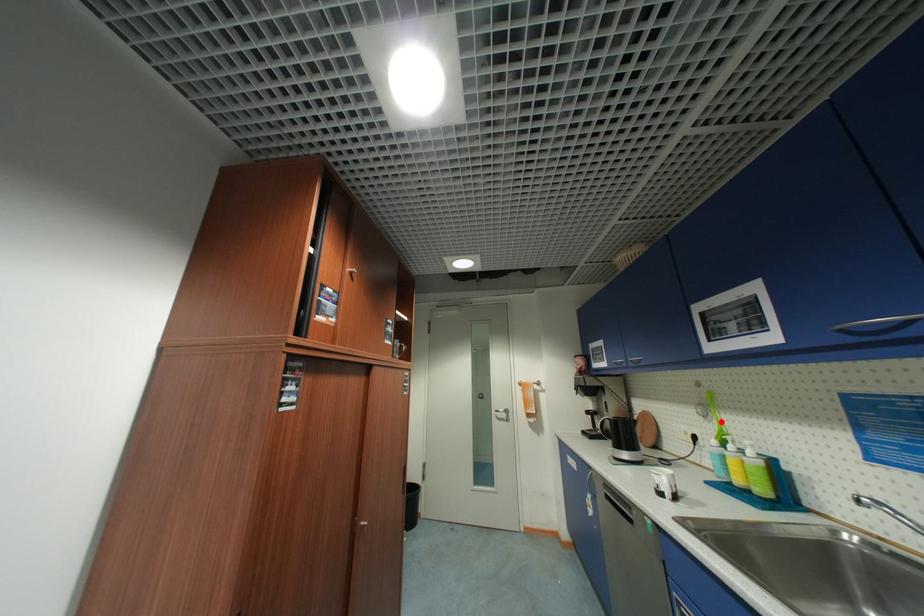
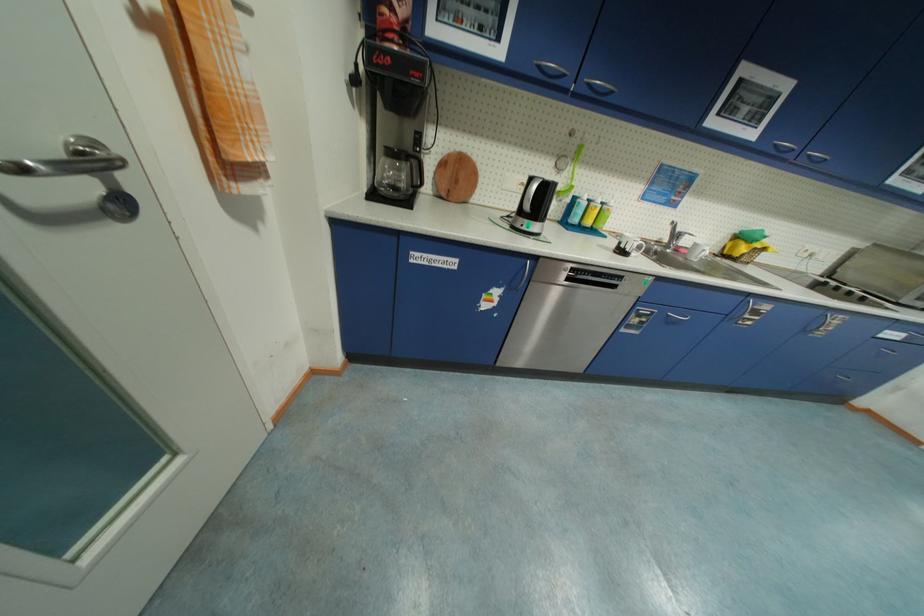
Question: A red point is marked in image1. In image2, is the corresponding 3D point closer to the camera or farther? Reply with the corresponding letter.

Choices:
 (A) The corresponding 3D point is closer.
 (B) The corresponding 3D point is farther.

Answer: (A)